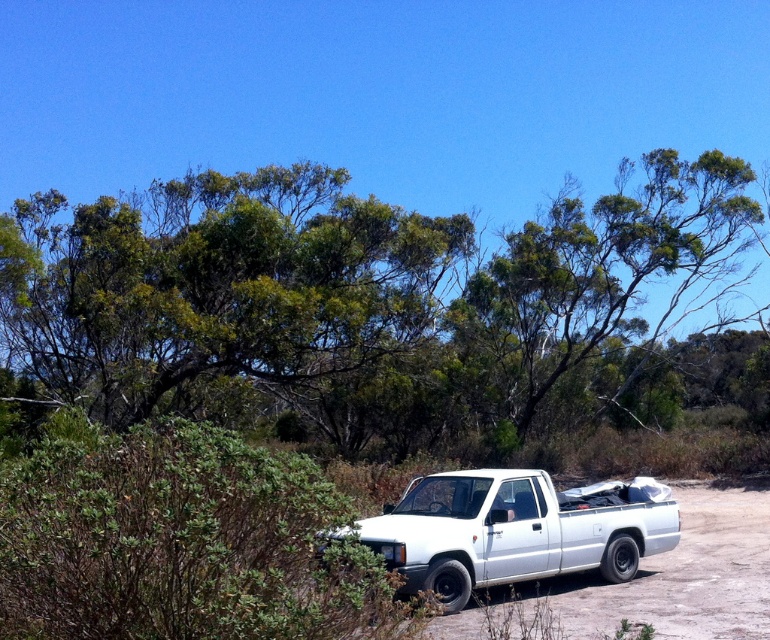
Which is more to the right, green leafy tree at upper center or white matte pickup truck at center?

white matte pickup truck at center

Does green leafy tree at upper center appear over white matte pickup truck at center?

Yes.

I want to click on green leafy tree at upper center, so click(363, 305).